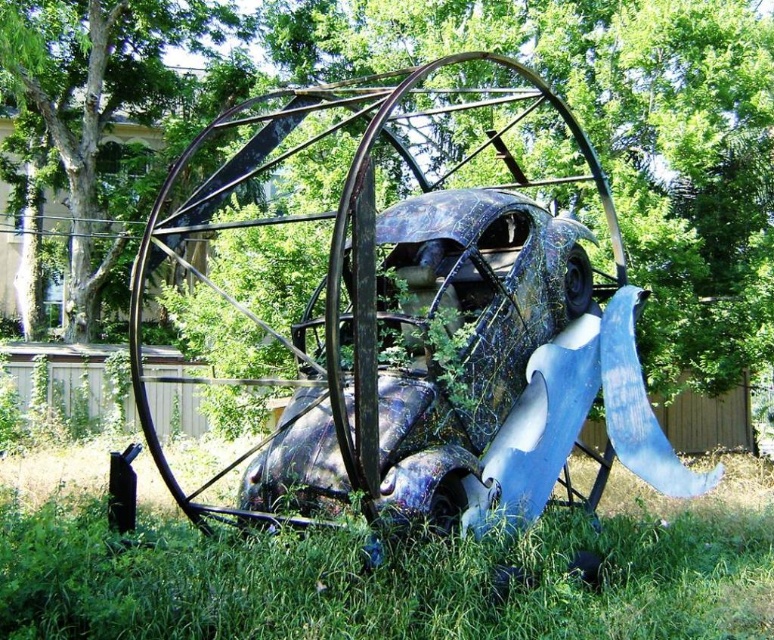
You are a GUI agent. You are given a task and a screenshot of the screen. Output one action in this format:
    pyautogui.click(x=<x>, y=<y>)
    Task: Click on the green leafy tree at center
    The width and height of the screenshot is (774, 640).
    Given the screenshot: What is the action you would take?
    pyautogui.click(x=586, y=131)

How much distance is there between green leafy tree at center and green leafy tree at upper center?

green leafy tree at center is 7.33 meters from green leafy tree at upper center.

Is point (755, 161) positioned in front of point (98, 84)?

Yes, it is.

The width and height of the screenshot is (774, 640). In order to click on green leafy tree at center in this screenshot , I will do `click(586, 131)`.

Does green grass at lower center have a greater height compared to green leafy tree at upper center?

In fact, green grass at lower center may be shorter than green leafy tree at upper center.

Is green grass at lower center positioned behind green leafy tree at upper center?

No, it is in front of green leafy tree at upper center.

Is point (598, 612) more distant than point (86, 237)?

No, (598, 612) is in front of (86, 237).

Locate an element on the screen. The image size is (774, 640). green grass at lower center is located at coordinates click(x=382, y=570).

Can you confirm if green leafy tree at center is positioned to the right of green grass at lower center?

In fact, green leafy tree at center is to the left of green grass at lower center.

Which is behind, point (649, 358) or point (642, 618)?

The point (649, 358) is more distant.

Image resolution: width=774 pixels, height=640 pixels. Find the location of `green leafy tree at center`. green leafy tree at center is located at coordinates (586, 131).